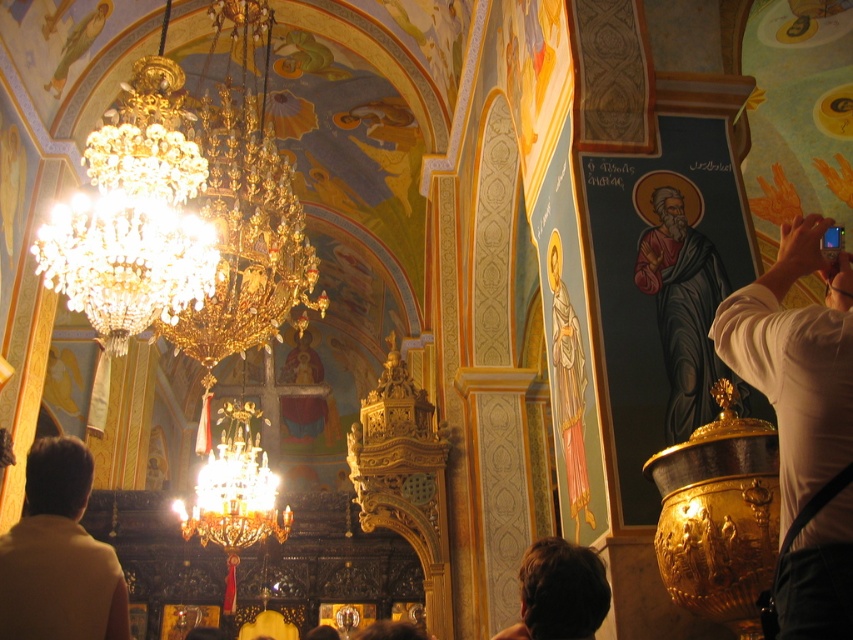
Question: Does white shirt at right have a larger size compared to matte black robe at right?

Choices:
 (A) no
 (B) yes

Answer: (B)

Question: Among these objects, which one is farthest from the camera?

Choices:
 (A) brown hair at lower center
 (B) white shirt at right
 (C) light brown leather jacket at lower left

Answer: (A)

Question: Does white shirt at right have a lesser width compared to matte black robe at right?

Choices:
 (A) no
 (B) yes

Answer: (A)

Question: Among these objects, which one is nearest to the camera?

Choices:
 (A) light brown leather jacket at lower left
 (B) brown hair at lower center
 (C) white shirt at right

Answer: (C)

Question: Is light brown leather jacket at lower left to the right of brown hair at lower center from the viewer's perspective?

Choices:
 (A) no
 (B) yes

Answer: (A)

Question: Which object is the farthest from the matte black robe at right?

Choices:
 (A) brown hair at lower center
 (B) light brown leather jacket at lower left
 (C) white shirt at right

Answer: (B)